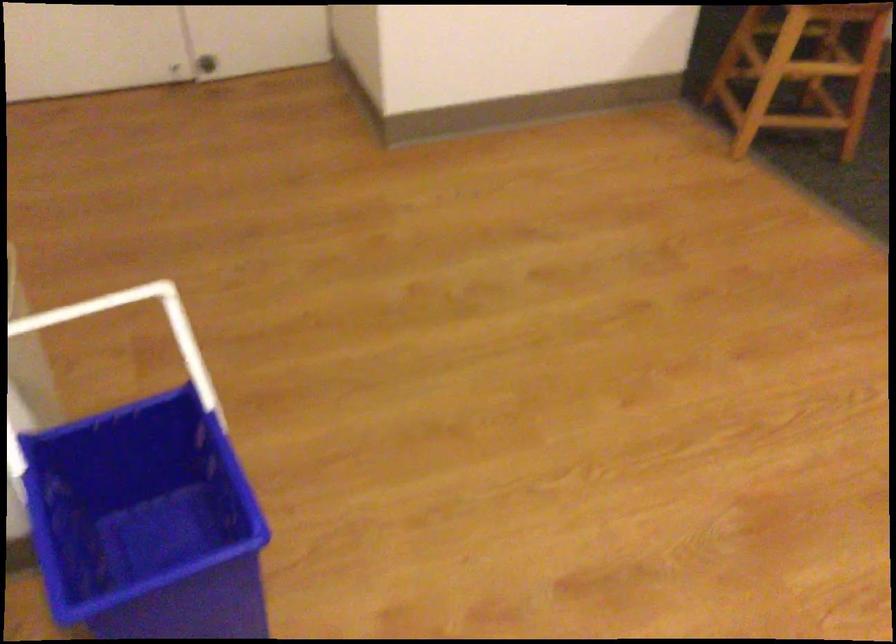
What are the coordinates of `white bin handle` in the screenshot? It's located at (58, 316).